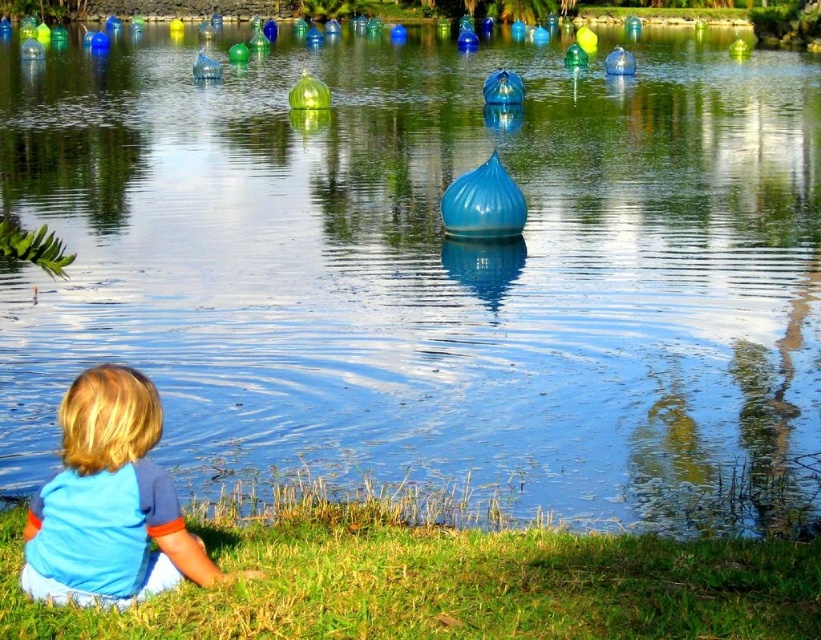
Between green grass at lower left and blue cotton shirt at lower left, which one is positioned higher?

blue cotton shirt at lower left

Is point (430, 608) farther from camera compared to point (44, 532)?

Yes, point (430, 608) is farther from viewer.

Where is `green grass at lower left`? The image size is (821, 640). green grass at lower left is located at coordinates (443, 579).